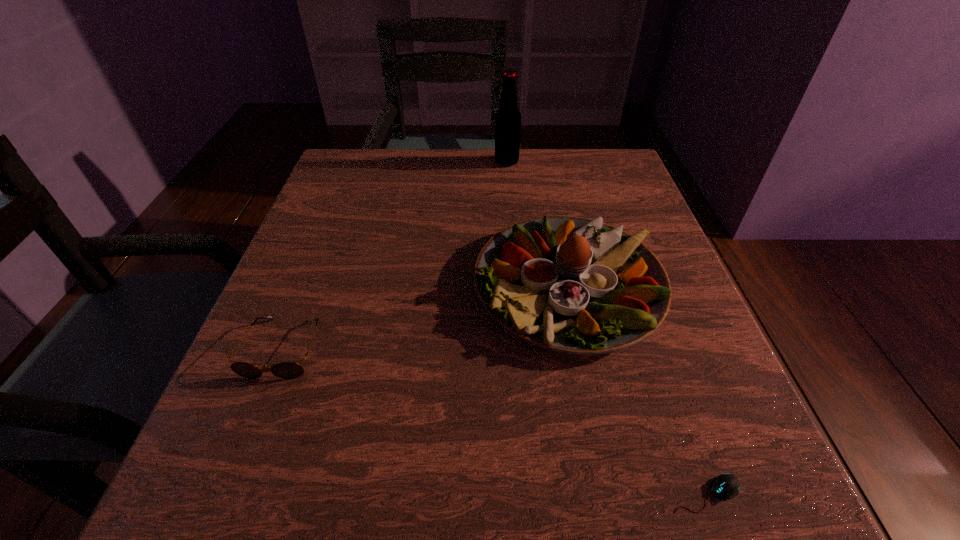
Locate an element on the screen. The height and width of the screenshot is (540, 960). vacant space located on the left of the shortest object is located at coordinates (522, 493).

Find the location of a particular element. This screenshot has height=540, width=960. object at the far edge is located at coordinates (508, 117).

Find the location of `object situated at the near edge`. object situated at the near edge is located at coordinates (724, 486).

This screenshot has width=960, height=540. I want to click on object located in the left edge section of the desktop, so click(287, 370).

Find the location of a particular element. salad plate located at the right edge is located at coordinates coord(569,284).

At what (x,y) coordinates should I click in order to perform the action: click on mouse at the right edge. Please return your answer as a coordinate pair (x, y). The width and height of the screenshot is (960, 540). Looking at the image, I should click on (724, 486).

At what (x,y) coordinates should I click in order to perform the action: click on object located at the near right corner. Please return your answer as a coordinate pair (x, y). Image resolution: width=960 pixels, height=540 pixels. Looking at the image, I should click on (724, 486).

Locate an element on the screen. The width and height of the screenshot is (960, 540). free location at the far edge is located at coordinates (425, 153).

Image resolution: width=960 pixels, height=540 pixels. Find the location of `vacant area at the left edge of the desktop`. vacant area at the left edge of the desktop is located at coordinates pos(338,370).

Where is `free point at the right edge`? The width and height of the screenshot is (960, 540). free point at the right edge is located at coordinates (672, 350).